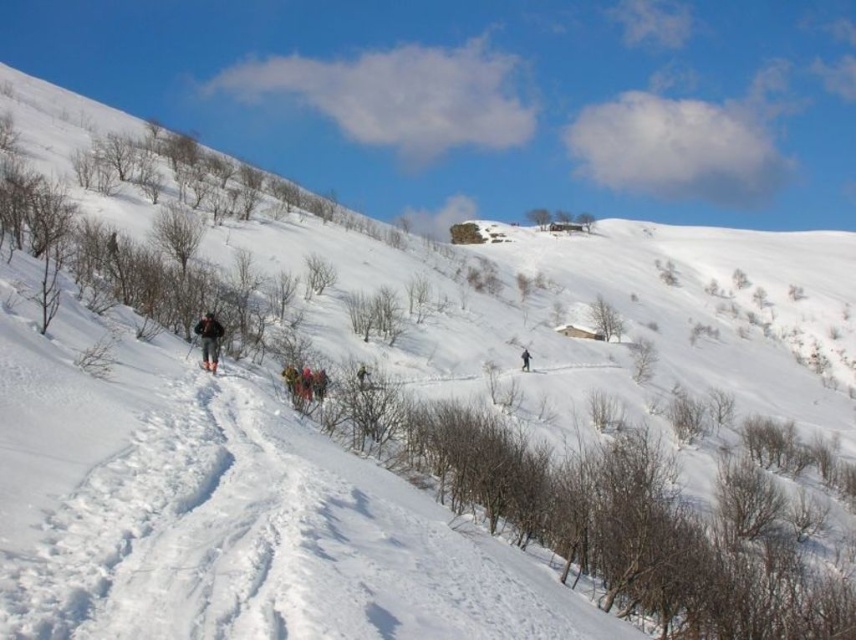
Question: Is the position of camouflage fabric jacket at center more distant than that of dark gray snowsuit at center?

Choices:
 (A) no
 (B) yes

Answer: (A)

Question: Does dark gray snowsuit at center appear under matte black ski at lower left?

Choices:
 (A) yes
 (B) no

Answer: (A)

Question: Which point is farther from the camera taking this photo?

Choices:
 (A) (522, 356)
 (B) (212, 340)
 (C) (310, 400)

Answer: (A)

Question: Does camouflage fabric jacket at center appear on the right side of matte black ski at lower left?

Choices:
 (A) yes
 (B) no

Answer: (B)

Question: Considering the real-world distances, which object is closest to the matte black ski at lower left?

Choices:
 (A) dark gray snowsuit at center
 (B) multicolored fabric group at center
 (C) camouflage fabric jacket at center
 (D) green fabric jacket at center

Answer: (C)

Question: Which point is closer to the camera?

Choices:
 (A) (360, 380)
 (B) (525, 355)

Answer: (A)